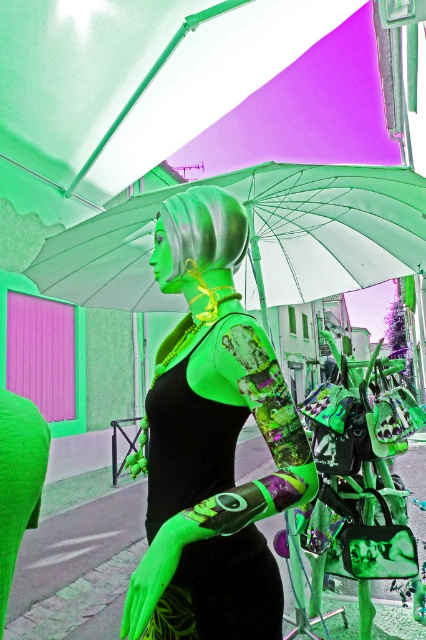
You are standing at the base of the pink wall with a window and want to place a small decorative item exactly at the point labeled point (187, 93). What object is located at that point?

The point (187, 93) is occupied by the green fabric canopy at upper center.

You are standing in front of the mannequin and looking at the scene. There are two points marked in the image, point 1 at coordinates point (x=322, y=205) and point 2 at coordinates point (x=5, y=474). Which point is closer to you?

Point (x=322, y=205) is further to the camera than point (x=5, y=474), so the closer point to you is point (x=5, y=474).

You are a photographer setting up a shoot in this surreal outdoor scene. You need to position a light source to the left of the black matte dress at center. Will the transparent plastic umbrella at center block the light from reaching the dress?

The transparent plastic umbrella at center is to the right of the black matte dress at center, so the light placed to the left of the dress will not be blocked by the umbrella and will reach the dress.